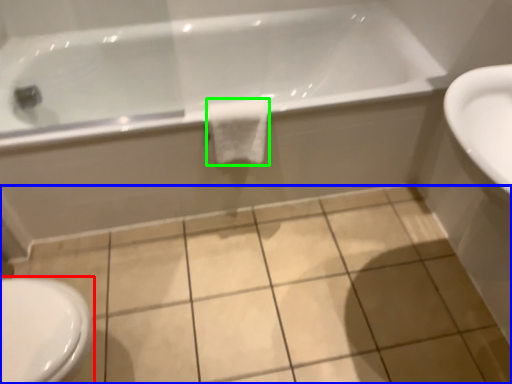
Question: Which object is the farthest from bidet (highlighted by a red box)? Choose among these: ceramic tile (highlighted by a blue box) or bath towel (highlighted by a green box).

Choices:
 (A) ceramic tile
 (B) bath towel

Answer: (B)